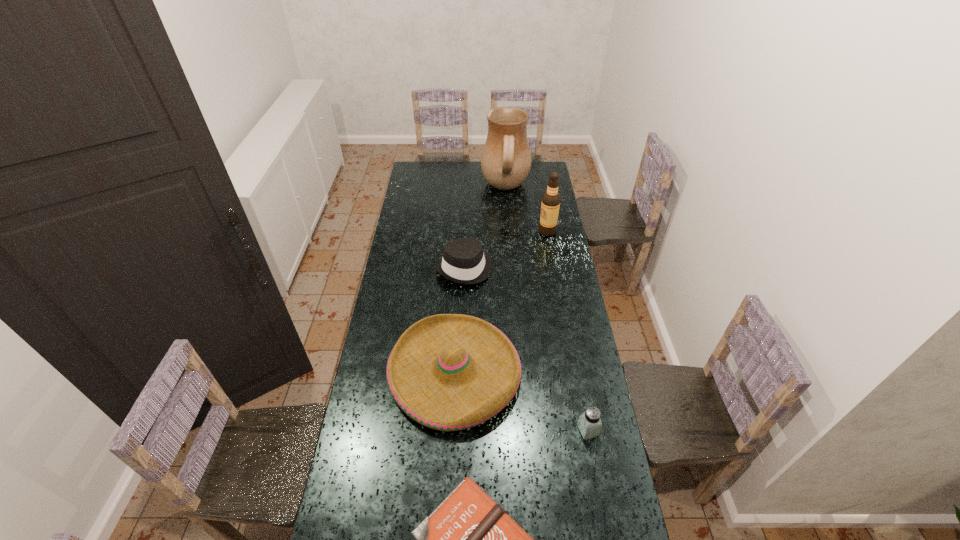
Identify which object is located as the second nearest to the cream pitcher. Please provide its 2D coordinates. Your answer should be formatted as a tuple, i.e. [(x, y)], where the tuple contains the x and y coordinates of a point satisfying the conditions above.

[(464, 262)]

I want to click on object that is the fourth closest to the saltshaker, so click(x=550, y=204).